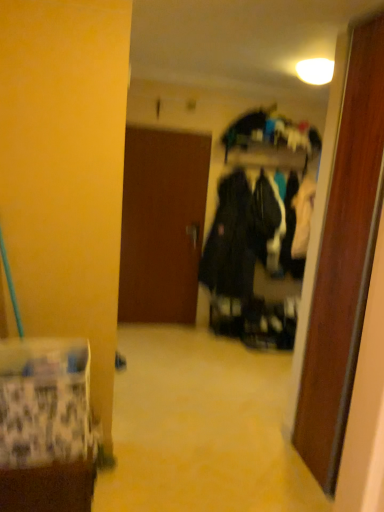
Identify the location of free space above brown matte door at center (from a real-world perspective). The image size is (384, 512). (168, 131).